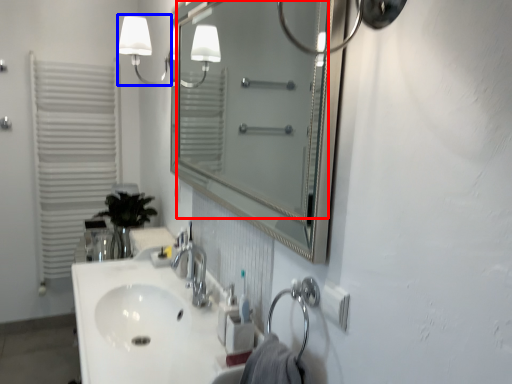
Question: Which object appears farthest to the camera in this image, mirror (highlighted by a red box) or light fixture (highlighted by a blue box)?

Choices:
 (A) mirror
 (B) light fixture

Answer: (B)